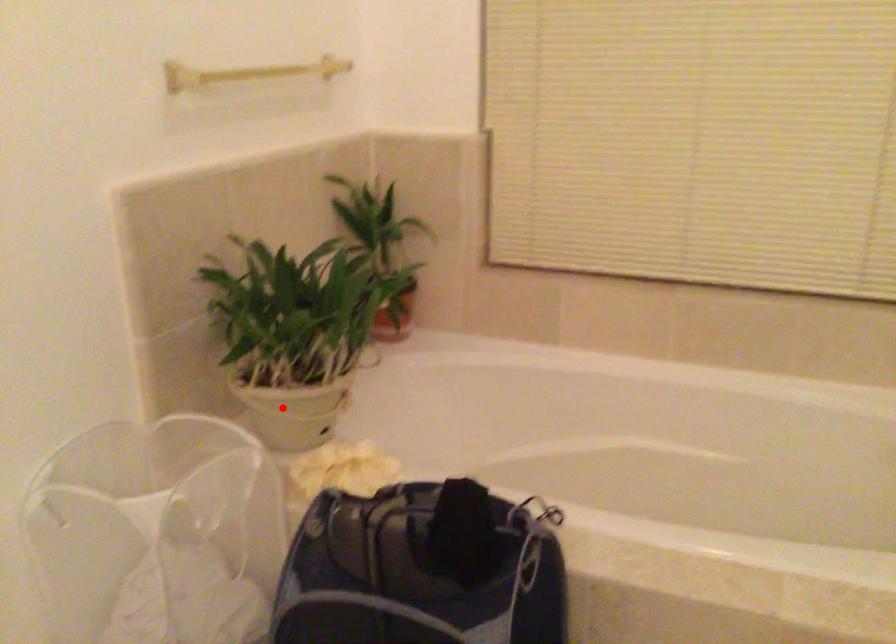
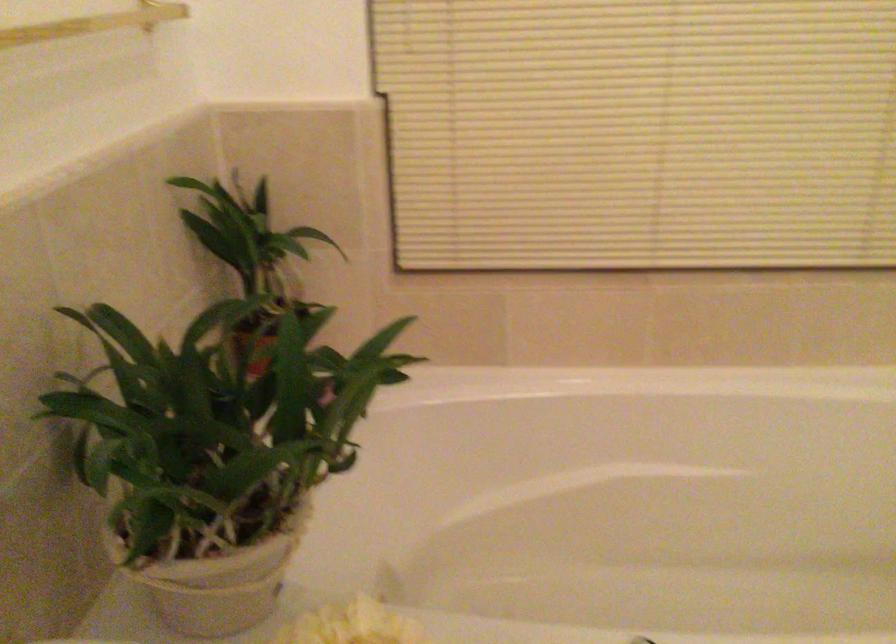
Locate, in the second image, the point that corresponds to the highlighted location in the first image.

(218, 579)